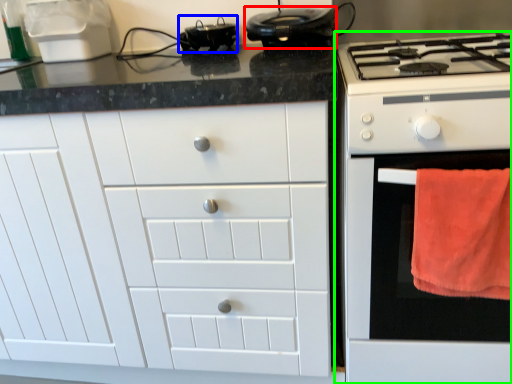
Question: Which is nearer to the kitchen appliance (highlighted by a red box)? appliance (highlighted by a blue box) or home appliance (highlighted by a green box).

Choices:
 (A) appliance
 (B) home appliance

Answer: (A)